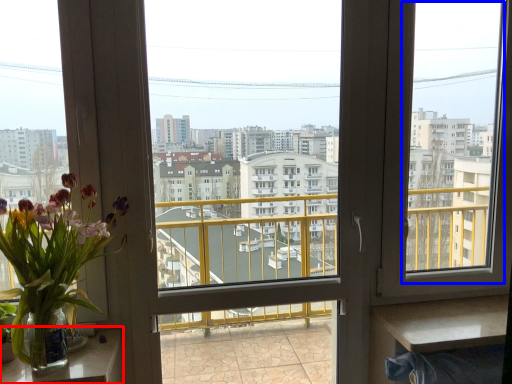
Question: Which object appears closest to the camera in this image, table (highlighted by a red box) or window screen (highlighted by a blue box)?

Choices:
 (A) table
 (B) window screen

Answer: (A)